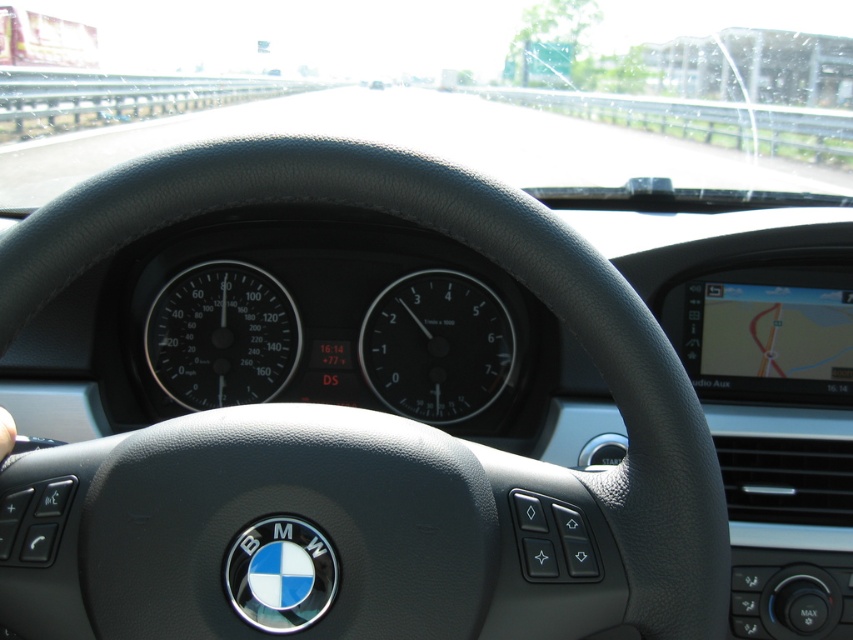
Is transparent glass windshield at upper center taller than black glass tachometer at center?

Indeed, transparent glass windshield at upper center has a greater height compared to black glass tachometer at center.

Between point (495, 58) and point (386, 385), which one is positioned in front?

Point (386, 385) is in front.

Locate an element on the screen. This screenshot has width=853, height=640. transparent glass windshield at upper center is located at coordinates (299, 35).

Between transparent glass windshield at upper center and black matte speedometer at center, which one is positioned lower?

black matte speedometer at center

Looking at this image, who is more forward, (466, 16) or (283, 360)?

Point (283, 360) is in front.

Between point (120, 38) and point (241, 356), which one is positioned behind?

The point (120, 38) is more distant.

Find the location of a particular element. The image size is (853, 640). transparent glass windshield at upper center is located at coordinates coord(299,35).

Between black glass tachometer at center and black matte speedometer at center, which one has more height?

black glass tachometer at center

Is black glass tachometer at center further to camera compared to black matte speedometer at center?

Yes, black glass tachometer at center is further from the viewer.

Is point (405, 321) positioned after point (172, 288)?

Yes, point (405, 321) is farther from viewer.

Identify the location of black glass tachometer at center. Image resolution: width=853 pixels, height=640 pixels. click(x=436, y=346).